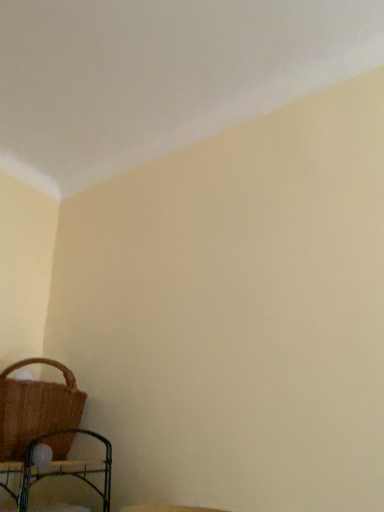
The image size is (384, 512). Describe the element at coordinates (35, 408) in the screenshot. I see `brown woven picnic basket at lower left` at that location.

Locate an element on the screen. The image size is (384, 512). brown woven picnic basket at lower left is located at coordinates (35, 408).

Measure the distance between brown woven picnic basket at lower left and camera.

brown woven picnic basket at lower left is 1.24 meters away from camera.

Locate an element on the screen. The height and width of the screenshot is (512, 384). brown woven picnic basket at lower left is located at coordinates (35, 408).